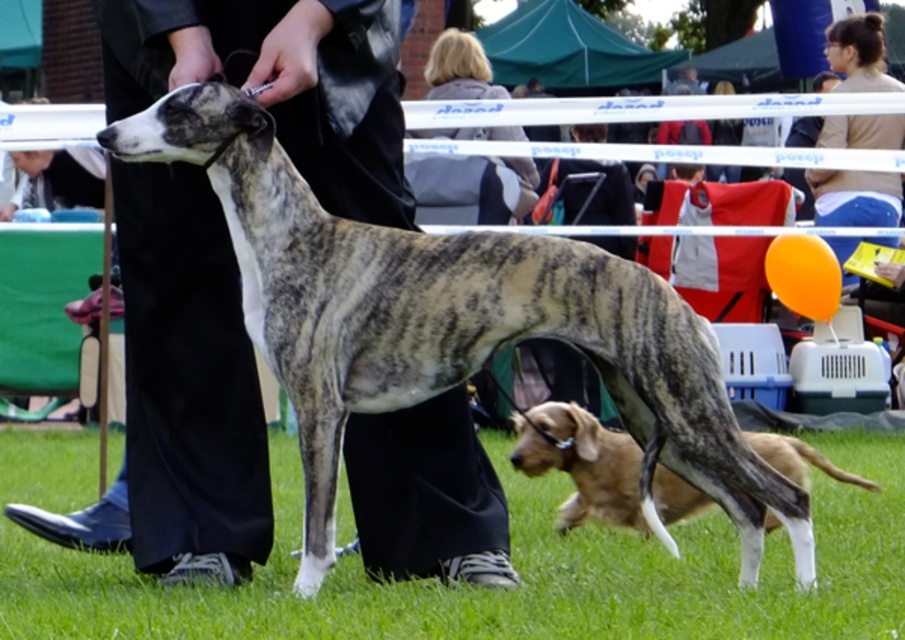
You are a small robot measuring 0.5 meters tall. You need to move from the smooth black pants at center to the green grass at lower center. Can you safely step over the gap between them?

The distance between the smooth black pants at center and the green grass at lower center is 1.23 meters. Since the robot is only 0.5 meters tall, it cannot safely step over the 1.23 meter gap. The robot would need to find an alternative path or a way to bridge the gap.

You are a photographer at the dog show and need to focus your camera on the smooth black pants at center. What are the exact coordinates where you should aim your camera?

The smooth black pants at center are located at coordinates point (187, 384).

You are a photographer standing at the edge of the field. You want to take a photo of the speckled fur dog at center and the brown fur dog at lower right. Can you fit both dogs into your camera frame if your camera has a maximum horizontal field of view of 1.6 meters?

The speckled fur dog at center and brown fur dog at lower right are 1.59 meters apart. Since the distance between them is less than the camera frame of 1.6 meters, both dogs can be captured in a single photo.